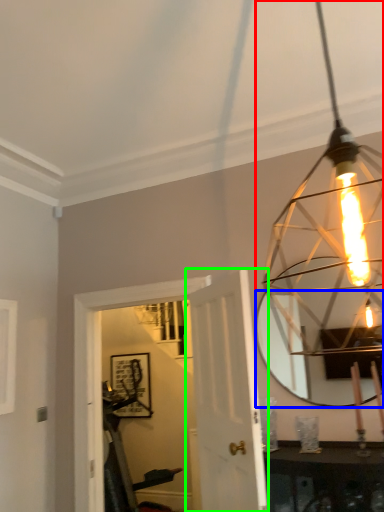
Question: Based on their relative distances, which object is farther from lamp (highlighted by a red box)? Choose from mirror (highlighted by a blue box) and door (highlighted by a green box).

Choices:
 (A) mirror
 (B) door

Answer: (B)